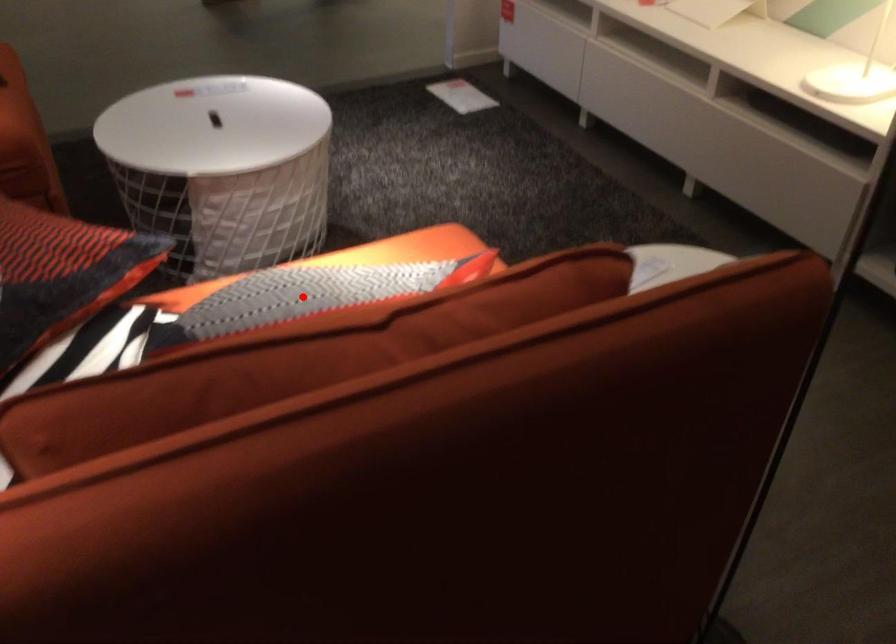
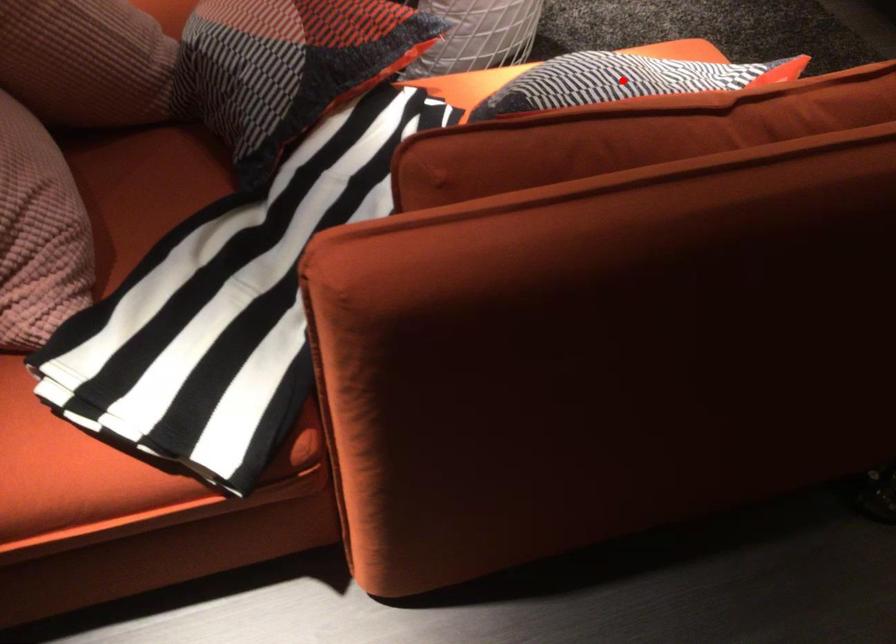
I am providing you with two images of the same scene from different viewpoints. A red point is marked on the first image and another point is marked on the second image. Do the highlighted points in image1 and image2 indicate the same real-world spot?

Yes